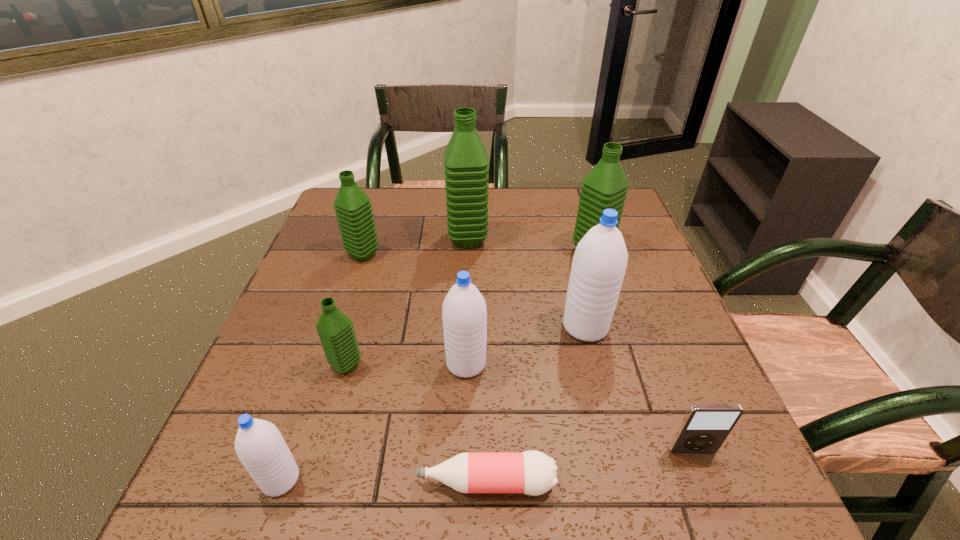
I want to click on the tallest water bottle, so click(466, 162).

This screenshot has width=960, height=540. I want to click on the tallest object, so click(466, 162).

You are a GUI agent. You are given a task and a screenshot of the screen. Output one action in this format:
    pyautogui.click(x=<x>, y=<y>)
    Task: Click on the second biggest green water bottle
    This screenshot has width=960, height=540.
    Given the screenshot: What is the action you would take?
    pyautogui.click(x=605, y=187)

Where is `the fourth farthest water bottle`? the fourth farthest water bottle is located at coordinates (599, 264).

Identify the location of the biggest blue water bottle. The height and width of the screenshot is (540, 960). (599, 264).

Find the location of `the second smallest green water bottle`. the second smallest green water bottle is located at coordinates (353, 208).

The image size is (960, 540). I want to click on the second blue water bottle from left to right, so click(x=464, y=313).

Where is `the second nearest blue water bottle`? the second nearest blue water bottle is located at coordinates (464, 313).

In order to click on the smallest green water bottle in this screenshot , I will do `click(336, 332)`.

The image size is (960, 540). In order to click on the smallest blue water bottle in this screenshot , I will do `click(260, 447)`.